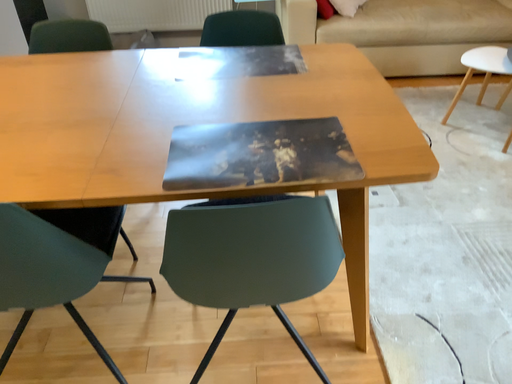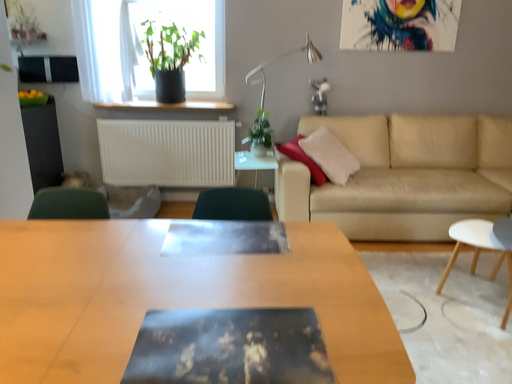
Question: Which way did the camera rotate in the video?

Choices:
 (A) rotated downward
 (B) rotated upward

Answer: (B)